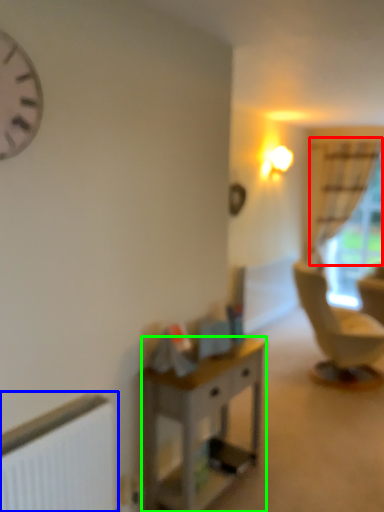
Question: Considering the real-world distances, which object is closest to curtain (highlighted by a red box)? radiator (highlighted by a blue box) or desk (highlighted by a green box).

Choices:
 (A) radiator
 (B) desk

Answer: (B)